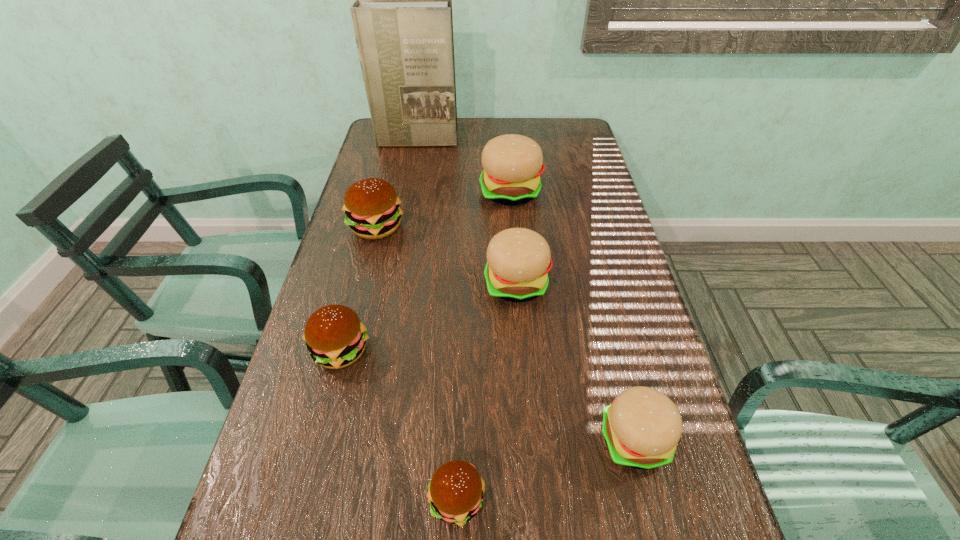
You are a GUI agent. You are given a task and a screenshot of the screen. Output one action in this format:
    pyautogui.click(x=<x>, y=<y>)
    Task: Click on the phonebook
    
    Given the screenshot: What is the action you would take?
    pyautogui.click(x=402, y=16)

Identify the location of the farthest object. (402, 16).

What are the coordinates of `the biggest beige hamburger` in the screenshot? It's located at (513, 164).

Locate an element on the screen. Image resolution: width=960 pixels, height=540 pixels. the biggest brown hamburger is located at coordinates (371, 205).

Where is `the fourth nearest object`? This screenshot has height=540, width=960. the fourth nearest object is located at coordinates (518, 260).

Find the location of `the fourth nearest hamburger`. the fourth nearest hamburger is located at coordinates (518, 260).

Locate an element on the screen. The width and height of the screenshot is (960, 540). the second nearest brown hamburger is located at coordinates (335, 337).

Find the location of `the second smallest brown hamburger`. the second smallest brown hamburger is located at coordinates (335, 337).

The width and height of the screenshot is (960, 540). Find the location of `the rightmost object`. the rightmost object is located at coordinates (641, 428).

Image resolution: width=960 pixels, height=540 pixels. I want to click on the nearest beige hamburger, so click(x=641, y=428).